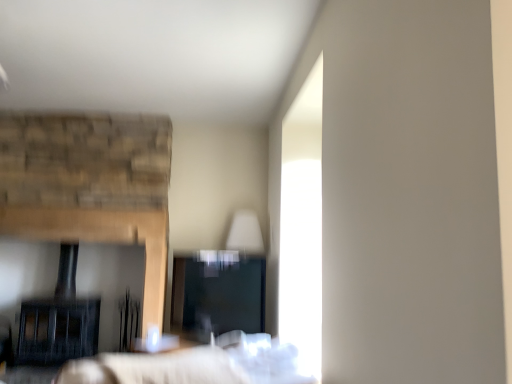
Question: Considering their positions, is black matte fireplace at left located in front of or behind white fabric bed at center?

Choices:
 (A) front
 (B) behind

Answer: (B)

Question: From a real-world perspective, is black matte fireplace at left positioned above or below white fabric bed at center?

Choices:
 (A) below
 (B) above

Answer: (B)

Question: Is black matte fireplace at left spatially inside white fabric bed at center, or outside of it?

Choices:
 (A) outside
 (B) inside

Answer: (A)

Question: Is point (141, 365) positioned closer to the camera than point (153, 155)?

Choices:
 (A) closer
 (B) farther

Answer: (A)

Question: Considering the positions of white fabric bed at center and black matte fireplace at left in the image, is white fabric bed at center taller or shorter than black matte fireplace at left?

Choices:
 (A) short
 (B) tall

Answer: (A)

Question: In terms of width, does white fabric bed at center look wider or thinner when compared to black matte fireplace at left?

Choices:
 (A) wide
 (B) thin

Answer: (A)

Question: Based on their positions, is white fabric bed at center located to the left or right of black matte fireplace at left?

Choices:
 (A) left
 (B) right

Answer: (B)